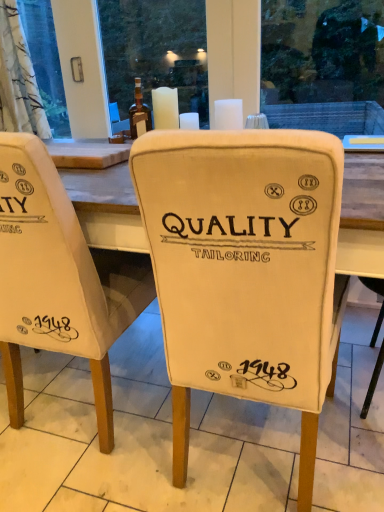
The height and width of the screenshot is (512, 384). I want to click on free spot below white fabric chair at center, placed as the first chair when sorted from right to left (from a real-world perspective), so click(x=253, y=445).